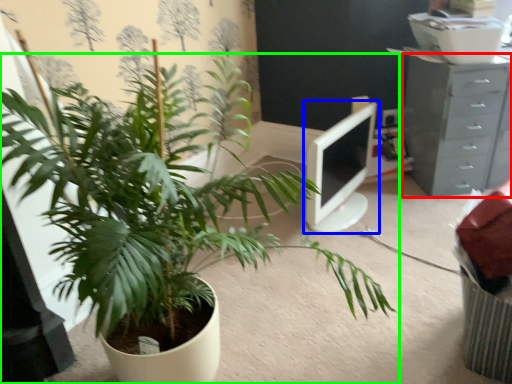
Question: Which object is positioned farthest from chest of drawers (highlighted by a red box)? Select from computer monitor (highlighted by a blue box) and houseplant (highlighted by a green box).

Choices:
 (A) computer monitor
 (B) houseplant

Answer: (B)